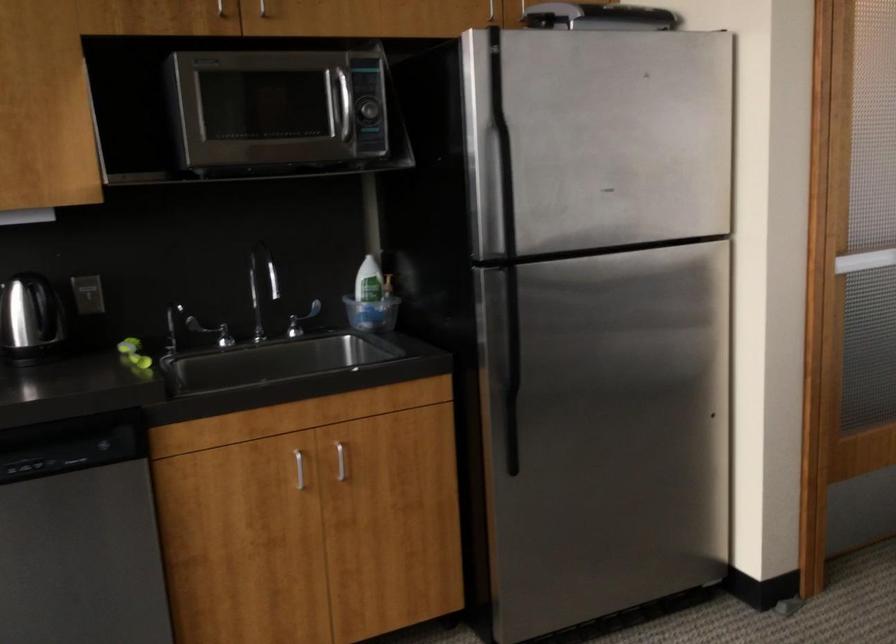
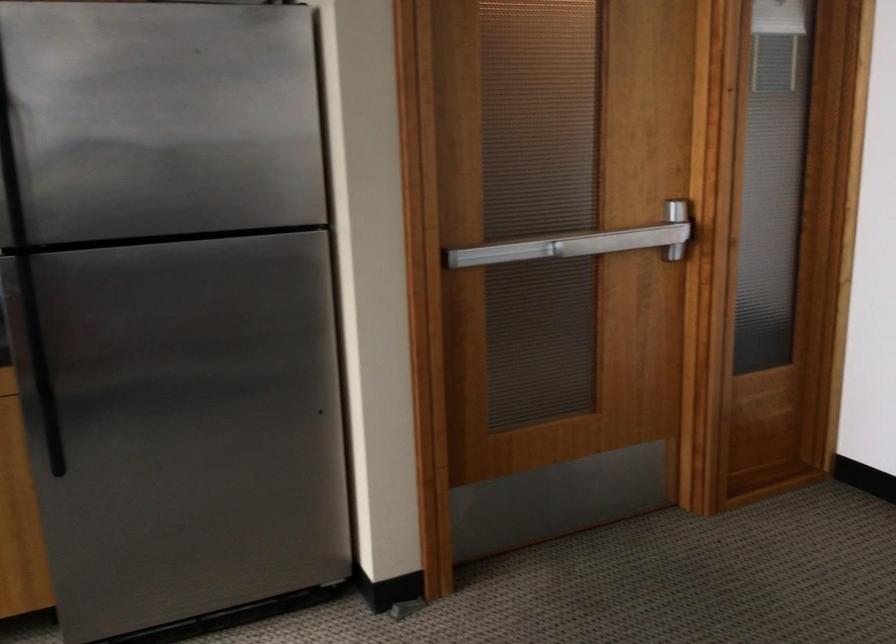
Question: The first image is from the beginning of the video and the second image is from the end. How did the camera likely rotate when shooting the video?

Choices:
 (A) Left
 (B) Right
 (C) Up
 (D) Down

Answer: (B)